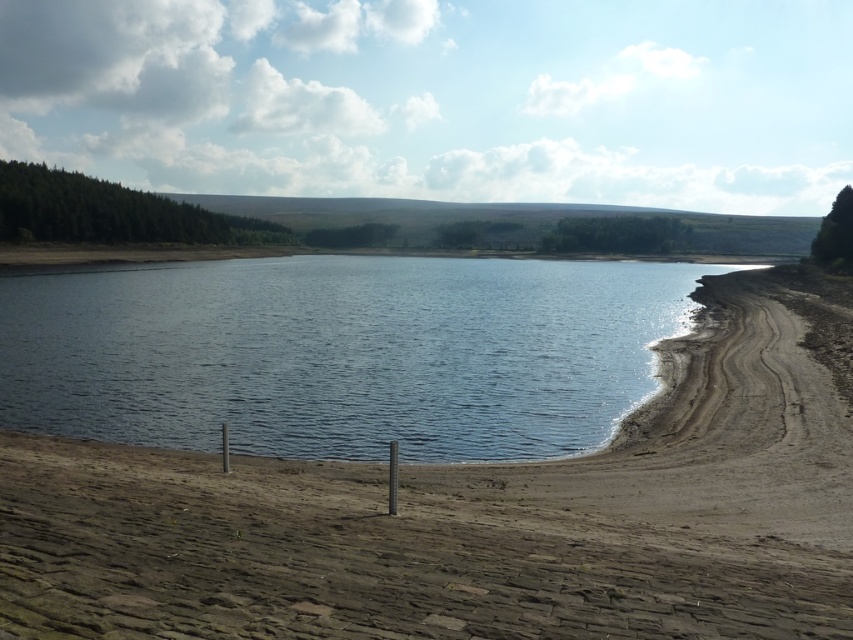
Which is in front, point (775, 634) or point (361, 348)?

Point (775, 634) is in front.

Measure the distance between point (109, 484) and camera.

The distance of point (109, 484) from camera is 41.87 feet.

This screenshot has width=853, height=640. What do you see at coordinates (370, 557) in the screenshot?
I see `brown/dry sand at lower center` at bounding box center [370, 557].

You are a GUI agent. You are given a task and a screenshot of the screen. Output one action in this format:
    pyautogui.click(x=<x>, y=<y>)
    Task: Click on the brown/dry sand at lower center
    This screenshot has width=853, height=640.
    Given the screenshot: What is the action you would take?
    pyautogui.click(x=370, y=557)